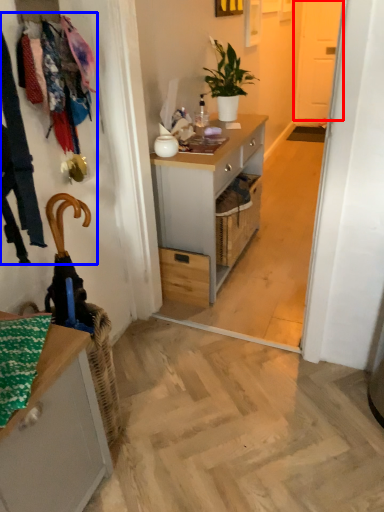
Question: Which point is further to the camera, screen door (highlighted by a red box) or laundry (highlighted by a blue box)?

Choices:
 (A) screen door
 (B) laundry

Answer: (A)